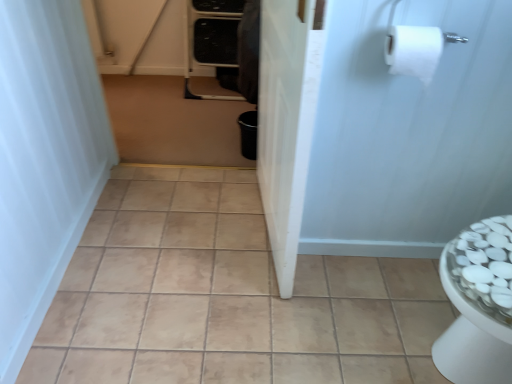
Locate an element on the screen. vacant space underneath white glossy screen door at center, acting as the first screen door starting from the left (from a real-world perspective) is located at coordinates (263, 232).